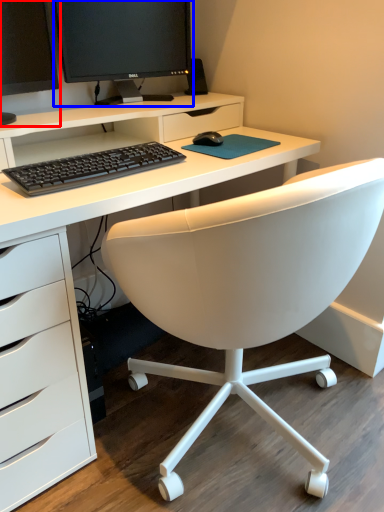
Question: Among these objects, which one is farthest to the camera, computer monitor (highlighted by a red box) or computer monitor (highlighted by a blue box)?

Choices:
 (A) computer monitor
 (B) computer monitor

Answer: (B)